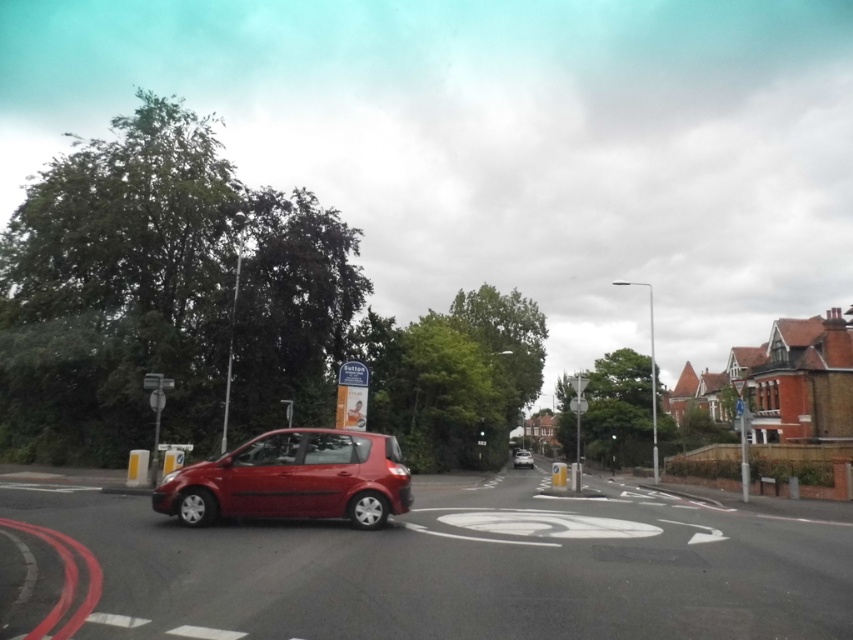
Which is above, shiny metallic car at lower left or metallic silver hatchback at center?

shiny metallic car at lower left is above.

Is shiny metallic car at lower left wider than metallic silver hatchback at center?

Yes.

The height and width of the screenshot is (640, 853). Describe the element at coordinates (460, 568) in the screenshot. I see `shiny metallic car at lower left` at that location.

You are a GUI agent. You are given a task and a screenshot of the screen. Output one action in this format:
    pyautogui.click(x=<x>, y=<y>)
    Task: Click on the shiny metallic car at lower left
    The image size is (853, 640).
    Given the screenshot: What is the action you would take?
    pyautogui.click(x=460, y=568)

Which of these two, shiny metallic car at lower left or glossy red hatchback at center-left, stands shorter?

glossy red hatchback at center-left is shorter.

Is shiny metallic car at lower left thinner than glossy red hatchback at center-left?

No, shiny metallic car at lower left is not thinner than glossy red hatchback at center-left.

This screenshot has width=853, height=640. What do you see at coordinates (460, 568) in the screenshot? I see `shiny metallic car at lower left` at bounding box center [460, 568].

Image resolution: width=853 pixels, height=640 pixels. Find the location of `shiny metallic car at lower left`. shiny metallic car at lower left is located at coordinates (460, 568).

Locate an element on the screen. The height and width of the screenshot is (640, 853). glossy red hatchback at center-left is located at coordinates (293, 480).

Between glossy red hatchback at center-left and metallic silver hatchback at center, which one has less height?

Standing shorter between the two is glossy red hatchback at center-left.

This screenshot has height=640, width=853. In order to click on glossy red hatchback at center-left in this screenshot , I will do tap(293, 480).